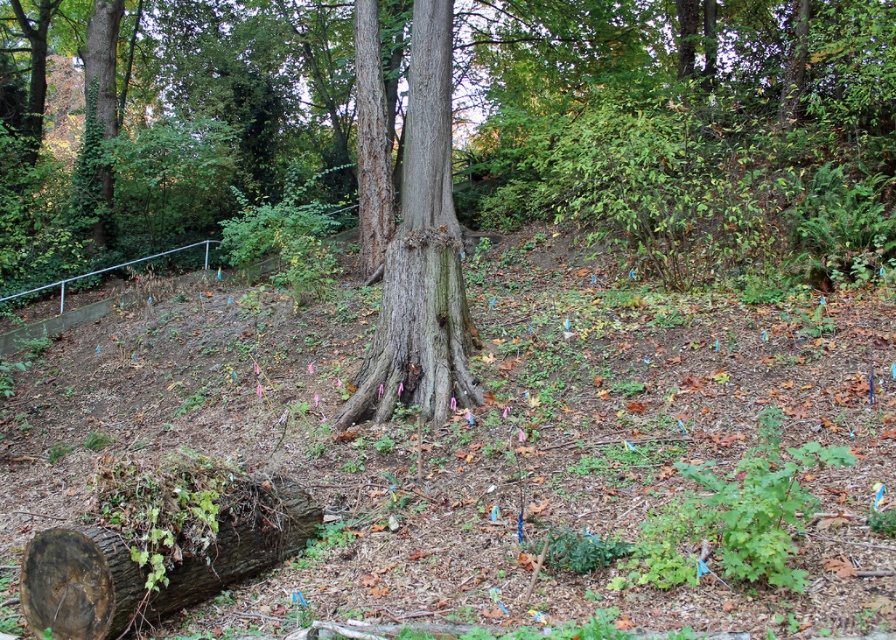
Question: Does smooth brown tree trunk at center appear under brown rough log at lower left?

Choices:
 (A) no
 (B) yes

Answer: (A)

Question: Which point is farther to the camera?

Choices:
 (A) brown rough log at lower left
 (B) smooth brown tree trunk at center

Answer: (B)

Question: Does smooth brown tree trunk at center have a smaller size compared to brown rough log at lower left?

Choices:
 (A) yes
 (B) no

Answer: (B)

Question: Which point appears closest to the camera in this image?

Choices:
 (A) (421, 145)
 (B) (291, 490)

Answer: (B)

Question: From the image, what is the correct spatial relationship of smooth brown tree trunk at center in relation to brown rough log at lower left?

Choices:
 (A) below
 (B) above

Answer: (B)

Question: Among these points, which one is farthest from the camera?

Choices:
 (A) (366, 400)
 (B) (260, 522)

Answer: (A)